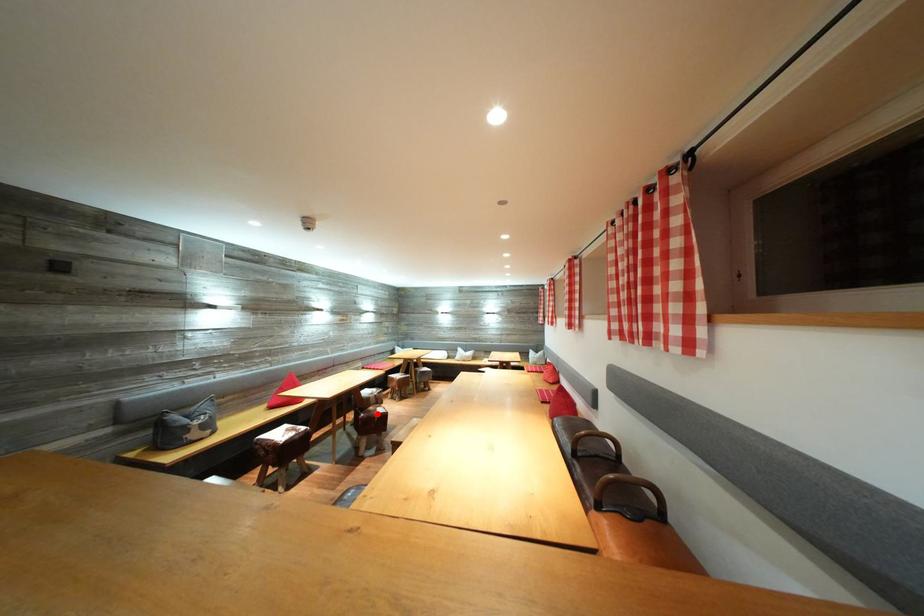
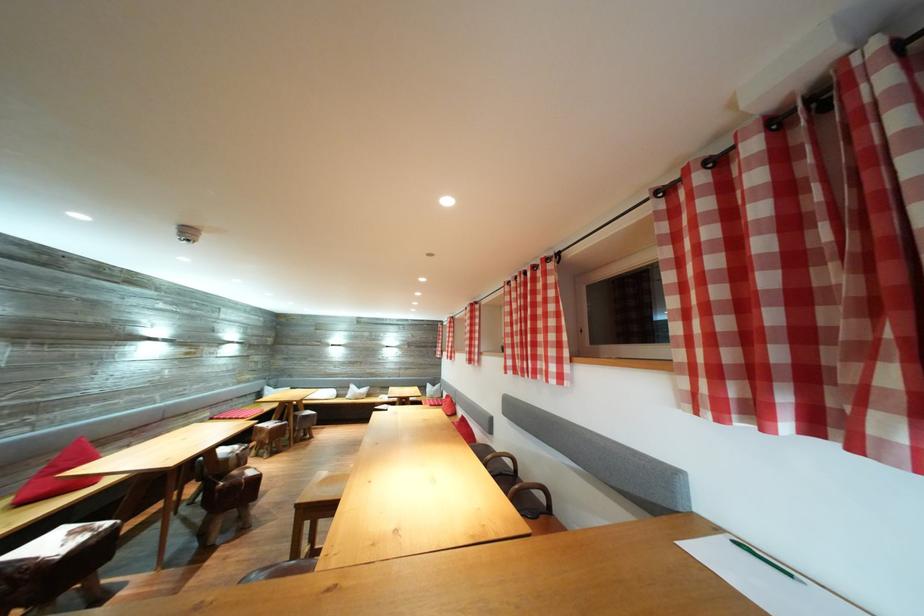
Question: I am providing you with two images of the same scene from different viewpoints. Given a red point in image1, look at the same physical point in image2. Is it:

Choices:
 (A) Closer to the viewpoint
 (B) Farther from the viewpoint

Answer: (B)